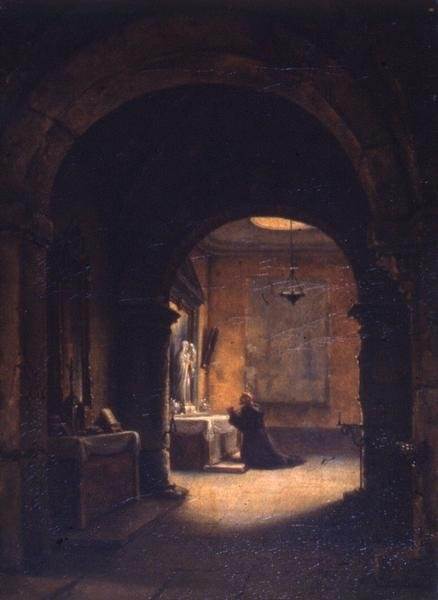
Identify the location of skylight. The height and width of the screenshot is (600, 438). (276, 224).